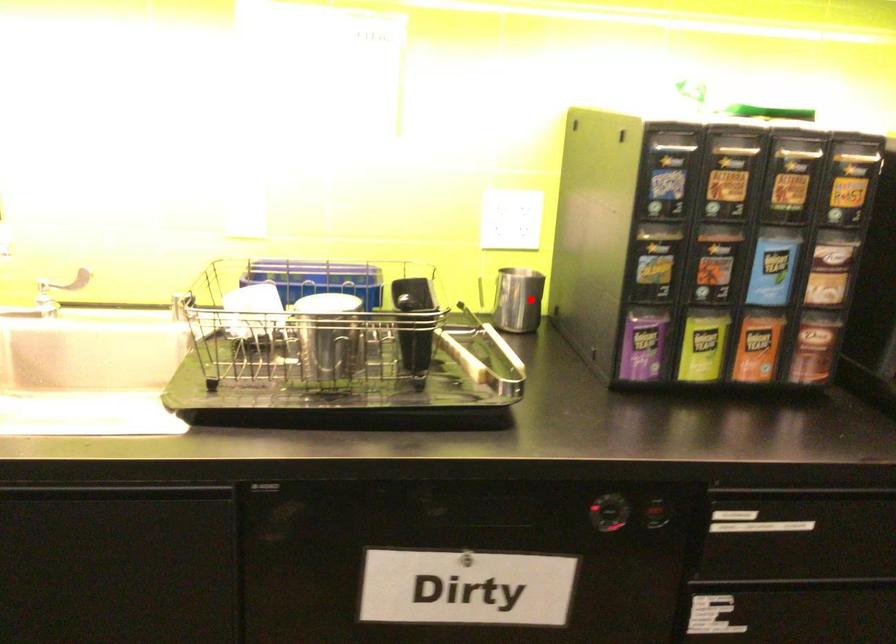
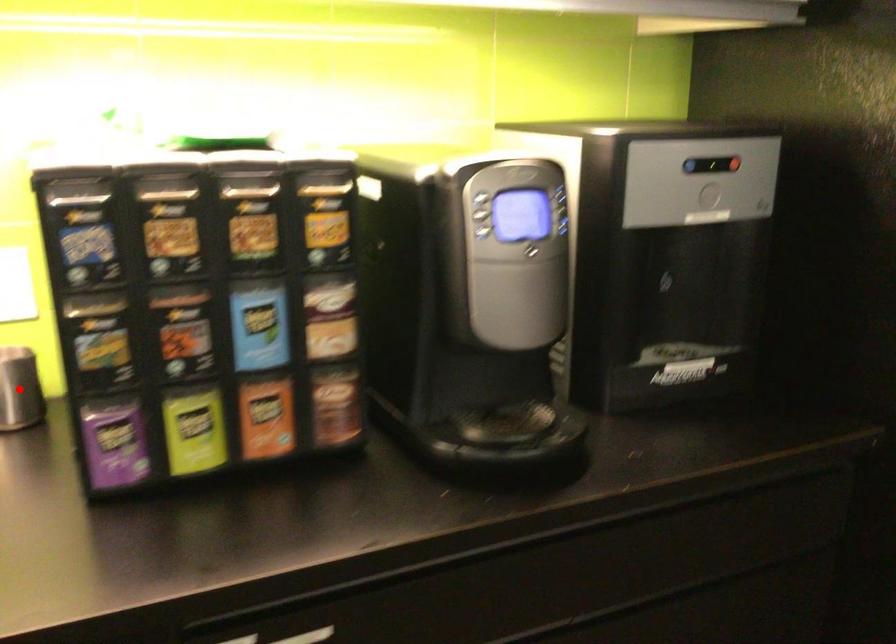
I am providing you with two images of the same scene from different viewpoints. A red point is marked on the first image and another point is marked on the second image. Is the marked point in image1 the same physical position as the marked point in image2?

Yes